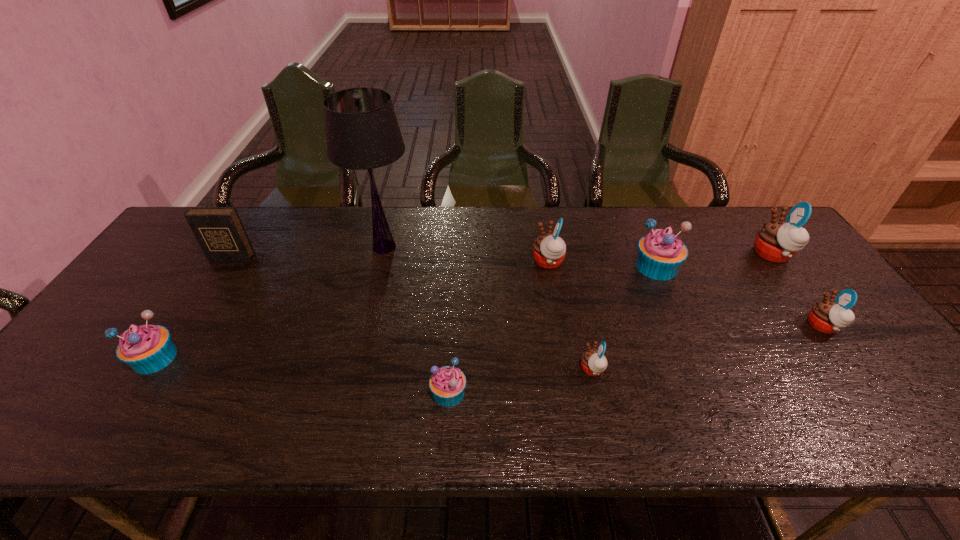
Identify the location of the seventh object from right to left. click(362, 132).

The height and width of the screenshot is (540, 960). Find the location of `lampshade`. lampshade is located at coordinates (362, 132).

Identify the location of the biggest pink muffin. The height and width of the screenshot is (540, 960). (777, 241).

In order to click on diary in this screenshot , I will do `click(219, 231)`.

You are a GUI agent. You are given a task and a screenshot of the screen. Output one action in this format:
    pyautogui.click(x=<x>, y=<y>)
    Task: Click on the third smallest pink muffin
    This screenshot has width=960, height=540.
    Given the screenshot: What is the action you would take?
    pyautogui.click(x=549, y=250)

Where is `the seventh object from left to right`? The width and height of the screenshot is (960, 540). the seventh object from left to right is located at coordinates (660, 253).

The image size is (960, 540). In order to click on the fifth muffin from left to right in this screenshot , I will do `click(660, 253)`.

Identify the location of the fourth nearest object. The height and width of the screenshot is (540, 960). (826, 316).

The height and width of the screenshot is (540, 960). In order to click on the second smallest pink muffin in this screenshot , I will do `click(826, 316)`.

You are a GUI agent. You are given a task and a screenshot of the screen. Output one action in this format:
    pyautogui.click(x=<x>, y=<y>)
    Task: Click on the leftmost muffin
    
    Given the screenshot: What is the action you would take?
    pyautogui.click(x=147, y=349)